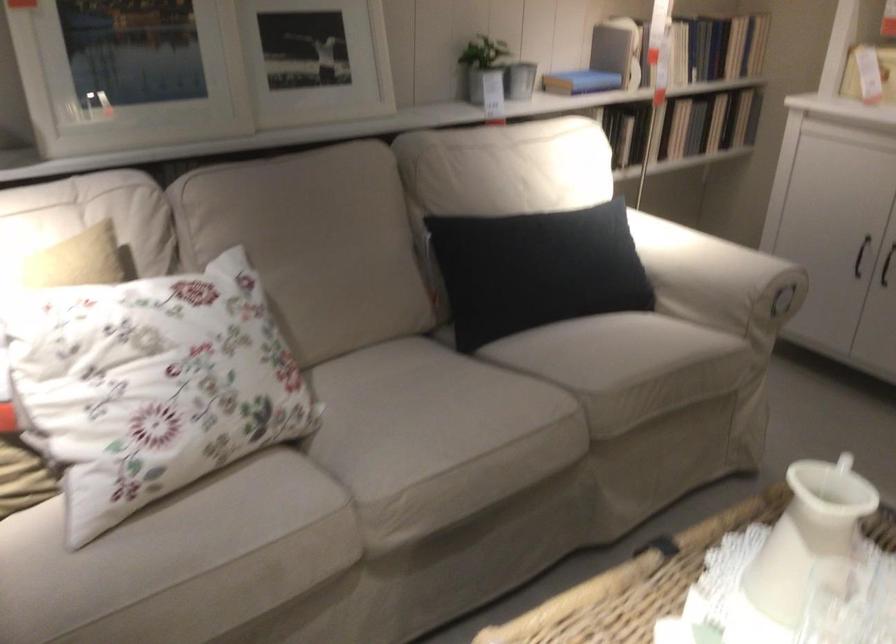
Find where to lean the beige sofa armrest. Please return your answer as a coordinate pair (x, y).

(717, 279)